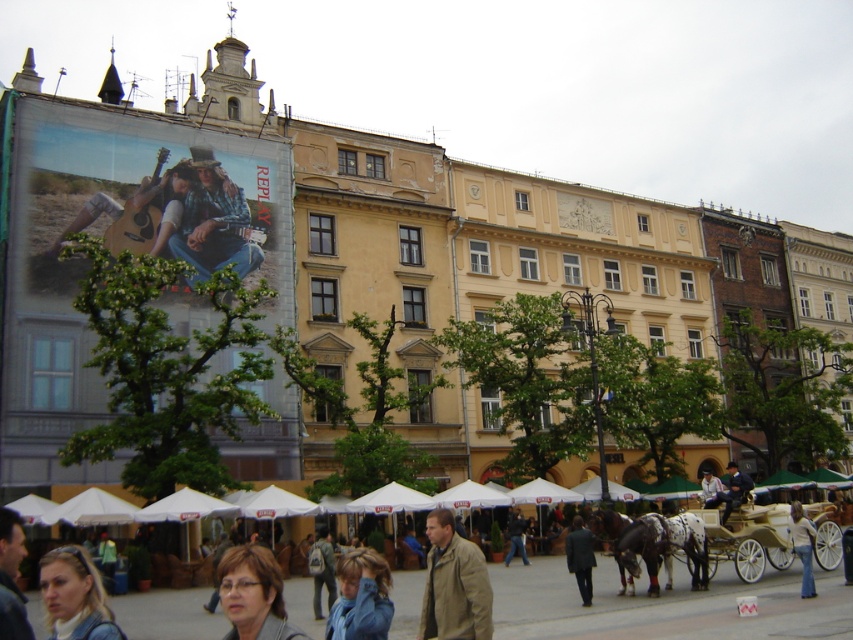
You are standing in the city square and want to take a photo of the blonde hair at lower left. Where should you position yourself to capture it in the frame?

To capture the blonde hair at lower left in the frame, position yourself at point (74, 596) where it is located.

You are standing at the entrance of the multi story beige building in the image. You want to go to the dark gray suit at center. Which direction should you walk to reach it?

Since the dark gray suit at center is located at coordinate point (579, 557), you should walk towards the center of the image to reach it.